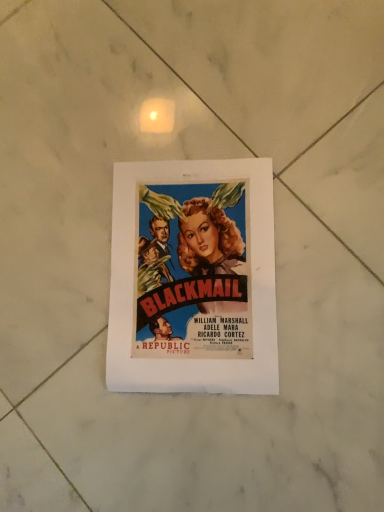
Where is `free space behind matte paper poster at center`? The width and height of the screenshot is (384, 512). free space behind matte paper poster at center is located at coordinates (120, 123).